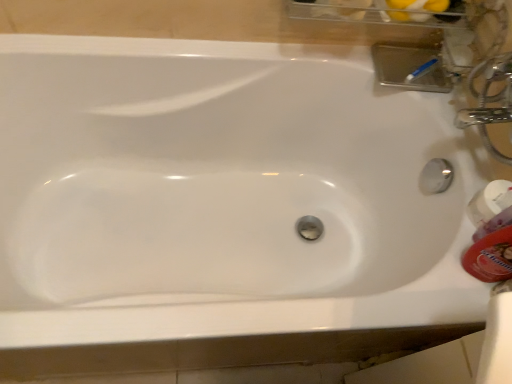
The height and width of the screenshot is (384, 512). What are the coordinates of `unoccupied space behind white glossy mouthwash at right, acting as the second mouthwash starting from the front` in the screenshot? It's located at (463, 149).